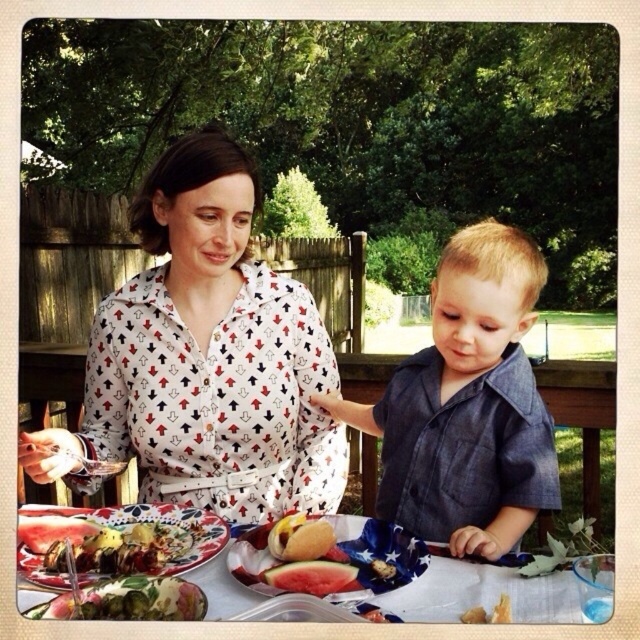
Question: Which point appears closest to the camera in this image?

Choices:
 (A) (198, 563)
 (B) (456, 266)
 (C) (406, 614)
 (D) (314, 586)

Answer: (C)

Question: Which object is the farthest from the denim shirt at center?

Choices:
 (A) watermelon slices at center
 (B) white printed shirt at upper center
 (C) floral-patterned fabric at lower center

Answer: (B)

Question: Where is white printed shirt at upper center located in relation to white fabric table at center in the image?

Choices:
 (A) below
 (B) above

Answer: (B)

Question: Which object is positioned closest to the green leafy salad at lower left?

Choices:
 (A) glazed ceramic platter at lower left
 (B) floral-patterned fabric at lower center
 (C) white fabric table at center

Answer: (B)

Question: Does floral-patterned fabric at lower center appear under glazed ceramic platter at lower left?

Choices:
 (A) no
 (B) yes

Answer: (B)

Question: Does floral-patterned fabric at lower center have a greater width compared to watermelon slices at center?

Choices:
 (A) yes
 (B) no

Answer: (A)